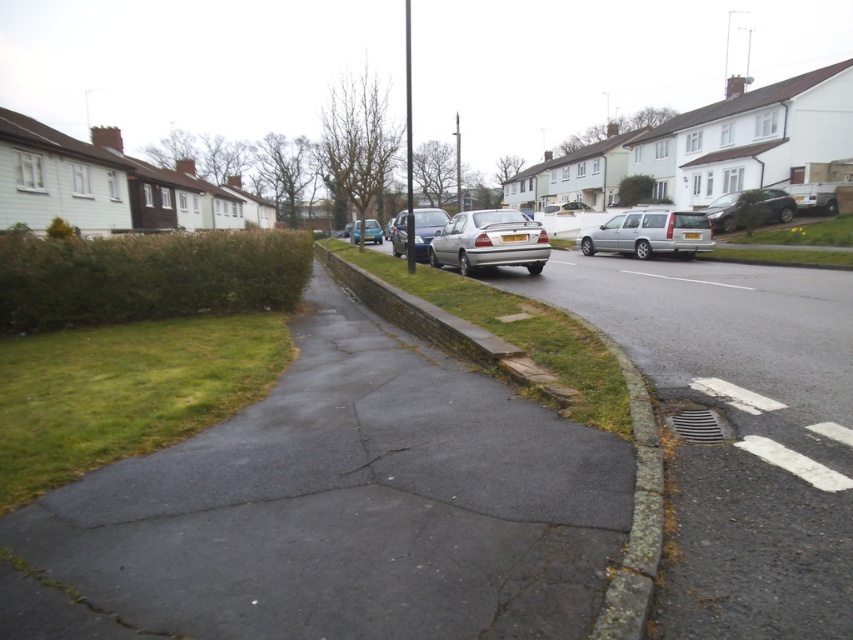
Question: Is satin silver sedan at center to the right of satin silver car at center from the viewer's perspective?

Choices:
 (A) yes
 (B) no

Answer: (A)

Question: Considering the real-world distances, which object is closest to the satin black suv at right?

Choices:
 (A) silver metallic station wagon at center
 (B) green grass at lower left
 (C) blue metallic car at center

Answer: (A)

Question: Among these points, which one is nearest to the camera?

Choices:
 (A) (439, 248)
 (B) (431, 230)
 (C) (384, 451)

Answer: (C)

Question: Is green grass at lower left wider than green grass at center?

Choices:
 (A) no
 (B) yes

Answer: (A)

Question: Observing the image, what is the correct spatial positioning of green grass at center in reference to cracked asphalt at center?

Choices:
 (A) right
 (B) left

Answer: (B)

Question: Considering the real-world distances, which object is farthest from the blue metallic car at center?

Choices:
 (A) smooth asphalt sidewalk at center
 (B) satin silver sedan at center
 (C) green grass at center

Answer: (A)